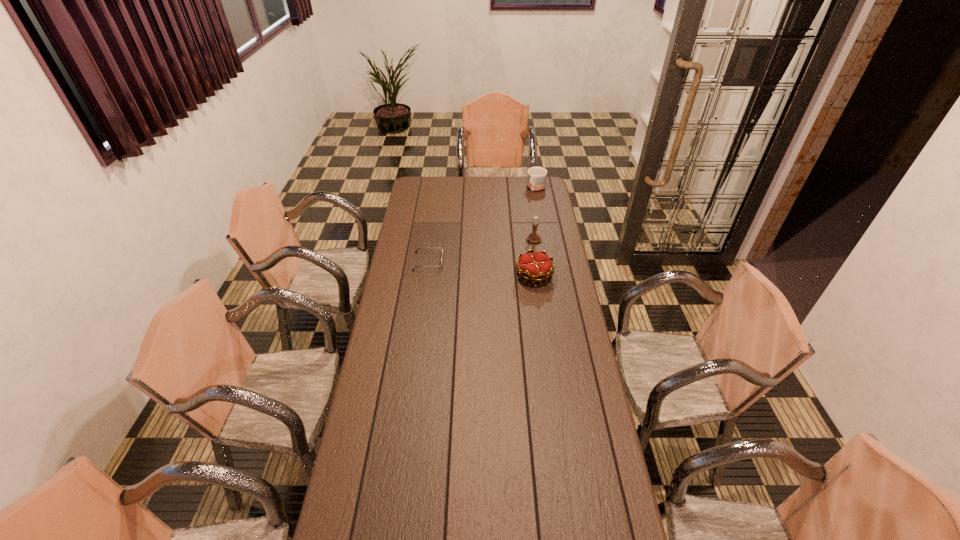
The height and width of the screenshot is (540, 960). Identify the location of sunglasses. (419, 248).

Locate an element on the screen. This screenshot has width=960, height=540. the shortest object is located at coordinates click(419, 248).

Identify the location of crown. The width and height of the screenshot is (960, 540). (536, 266).

Identify the location of candle holder. This screenshot has width=960, height=540. (534, 237).

At what (x,y) coordinates should I click in order to perform the action: click on the tallest object. Please return your answer as a coordinate pair (x, y). This screenshot has width=960, height=540. Looking at the image, I should click on (534, 237).

Identify the location of mug. pos(536,178).

At what (x,y) coordinates should I click in order to perform the action: click on vacant space located 0.050m on the front-facing side of the sunglasses. Please return your answer as a coordinate pair (x, y). Looking at the image, I should click on (453, 261).

You are a GUI agent. You are given a task and a screenshot of the screen. Output one action in this format:
    pyautogui.click(x=<x>, y=<y>)
    Task: Click on the free space located 0.190m on the back of the crown
    
    Given the screenshot: What is the action you would take?
    pyautogui.click(x=529, y=241)

You are a GUI agent. You are given a task and a screenshot of the screen. Output one action in this format:
    pyautogui.click(x=<x>, y=<y>)
    Task: Click on the free space located 0.310m on the side of the candle holder with the handle
    This screenshot has width=960, height=540.
    Given the screenshot: What is the action you would take?
    pyautogui.click(x=481, y=264)

You are a GUI agent. You are given a task and a screenshot of the screen. Output one action in this format:
    pyautogui.click(x=<x>, y=<y>)
    Task: Click on the vacant area situated on the side of the candle holder with the handle
    The width and height of the screenshot is (960, 540).
    Given the screenshot: What is the action you would take?
    pyautogui.click(x=483, y=264)